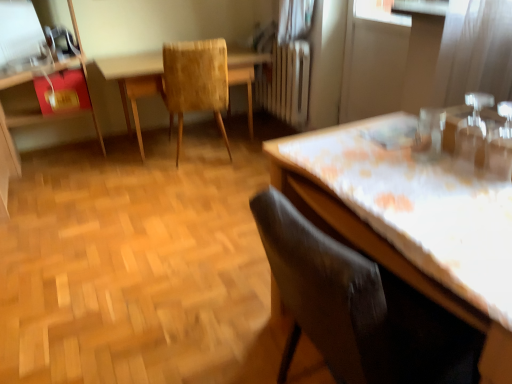
You are a GUI agent. You are given a task and a screenshot of the screen. Output one action in this format:
    pyautogui.click(x=<x>, y=<y>)
    Task: Click on the blank space situated above white floral tablecloth at right (from a real-world perspective)
    The width and height of the screenshot is (512, 384).
    Given the screenshot: What is the action you would take?
    pyautogui.click(x=417, y=173)